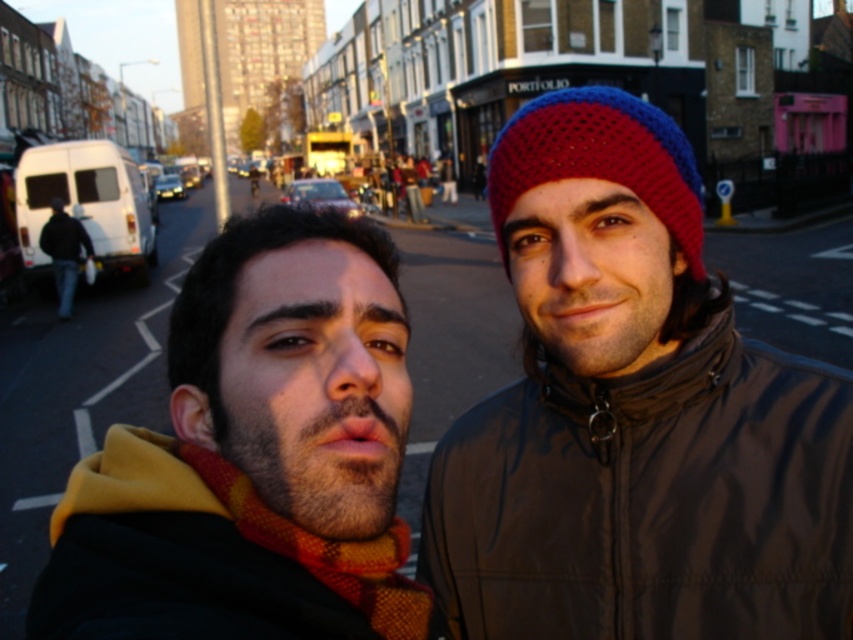
What do you see at coordinates (254, 456) in the screenshot?
I see `matte black jacket at center` at bounding box center [254, 456].

Does matte black jacket at center appear over knitted woolen beanie at center?

Actually, matte black jacket at center is below knitted woolen beanie at center.

What do you see at coordinates (254, 456) in the screenshot? I see `matte black jacket at center` at bounding box center [254, 456].

The height and width of the screenshot is (640, 853). Find the location of `matte black jacket at center`. matte black jacket at center is located at coordinates click(x=254, y=456).